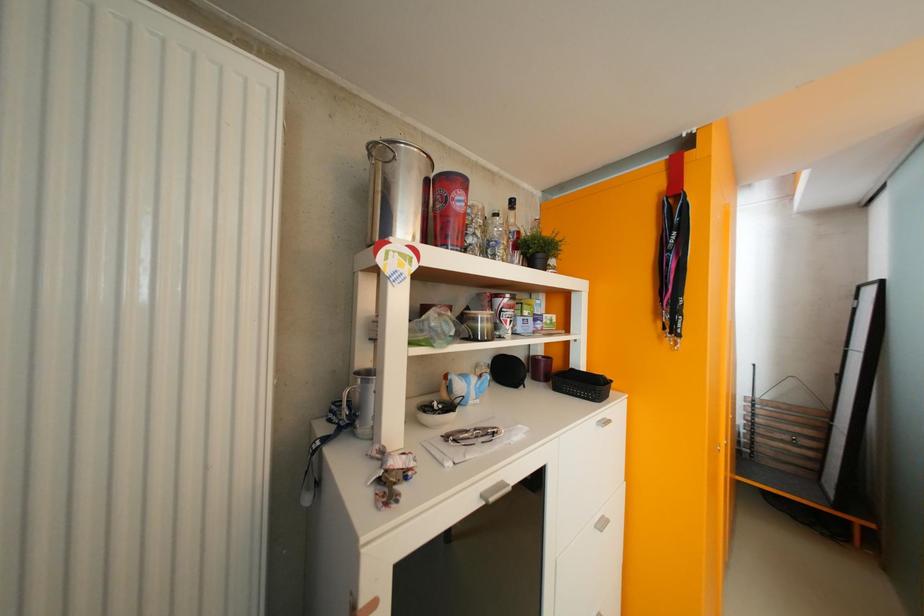
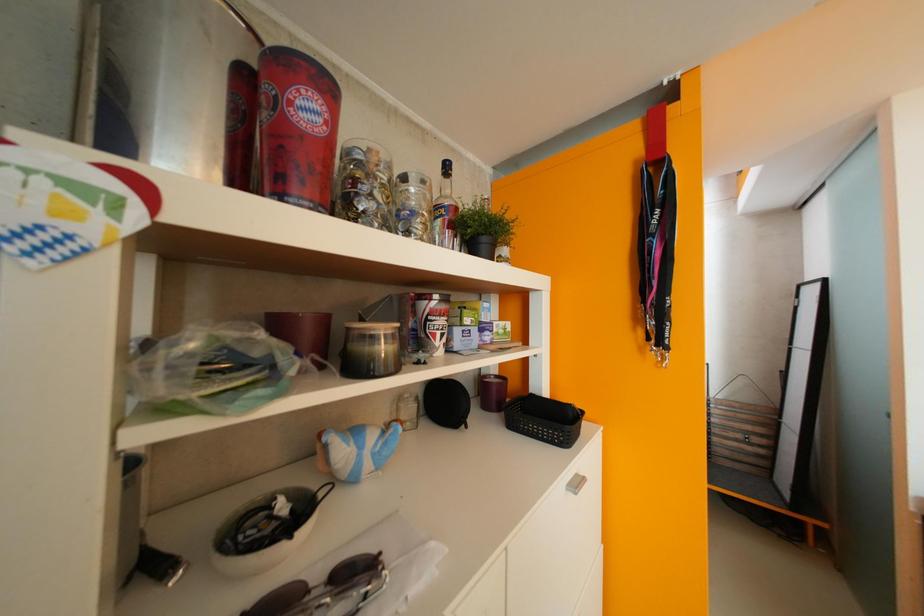
In a continuous first-person perspective shot, in which direction is the camera moving?

The movement direction of the cameraman is right, forward.